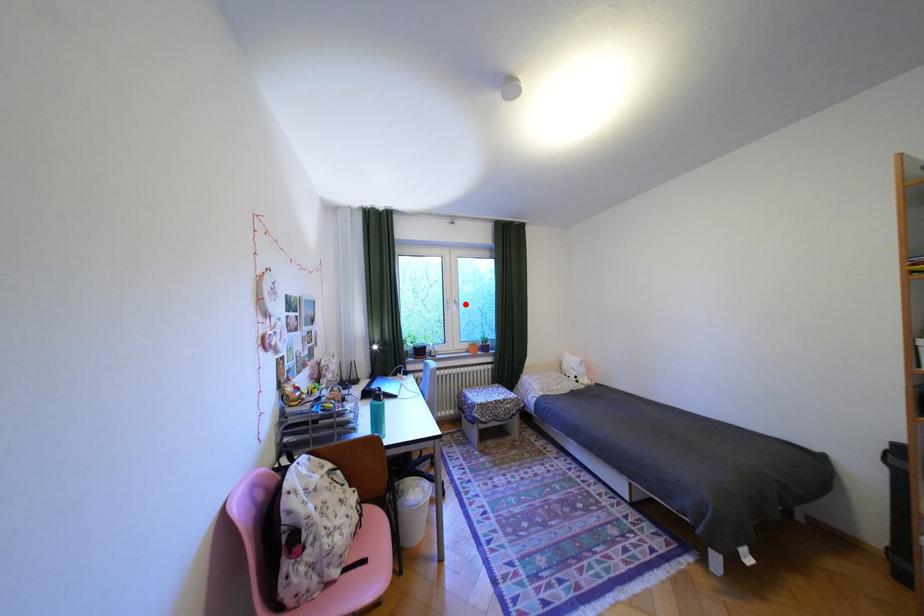
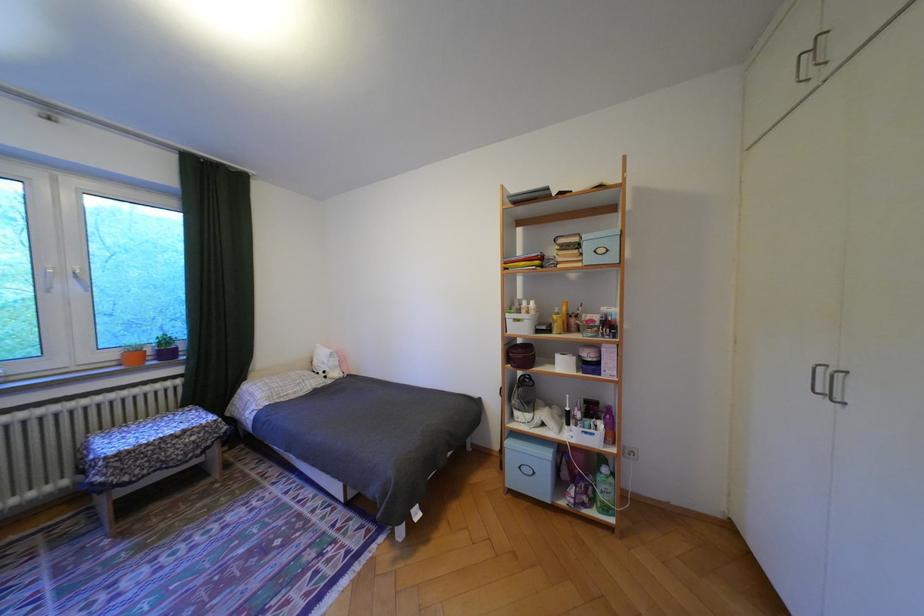
The point at the highlighted location is marked in the first image. Where is the corresponding point in the second image?

(84, 280)